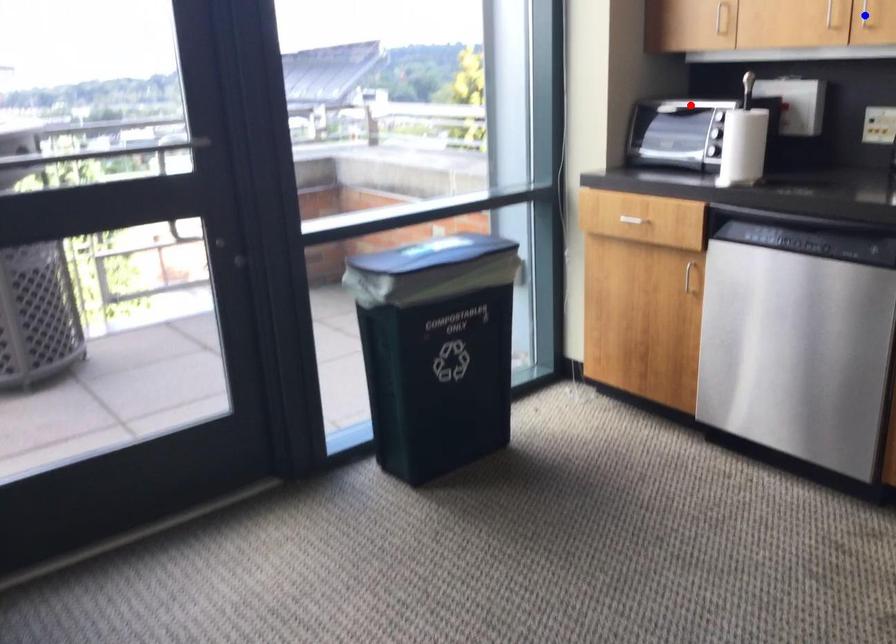
Question: In the image, two points are highlighted. Which point is nearer to the camera? Reply with the corresponding letter.

Choices:
 (A) blue point
 (B) red point

Answer: (A)